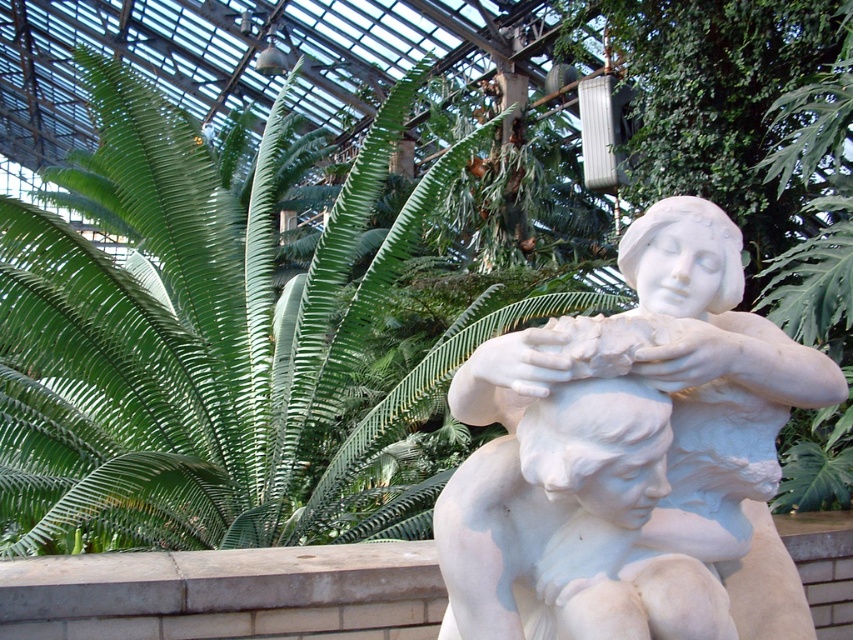
You are standing in the greenhouse and want to take a photo of both the green leafy fern at center and the white marble sculpture at center. Which object should you position to your left side to include both in the frame?

You should position the green leafy fern at center to your left side because it is already to the left of the white marble sculpture at center, allowing both to be captured in the frame.

You are a gardener trying to place a new decorative pot between the green leafy fern at center and the white marble sculpture at center. Based on their sizes, which object should you position closer to the edge to ensure the pot fits comfortably?

The green leafy fern at center might be wider than the white marble sculpture at center, so positioning the white marble sculpture at center closer to the edge would leave more space for the pot between them.

Based on the photo, you are a botanist examining the greenhouse layout. The marble sculpture with two figures is in the foreground. Where is the green leafy fern at center located in relation to the sculpture?

The green leafy fern at center is positioned at coordinates point (x=209, y=344), which places it centrally in the scene relative to the marble sculpture in the foreground.